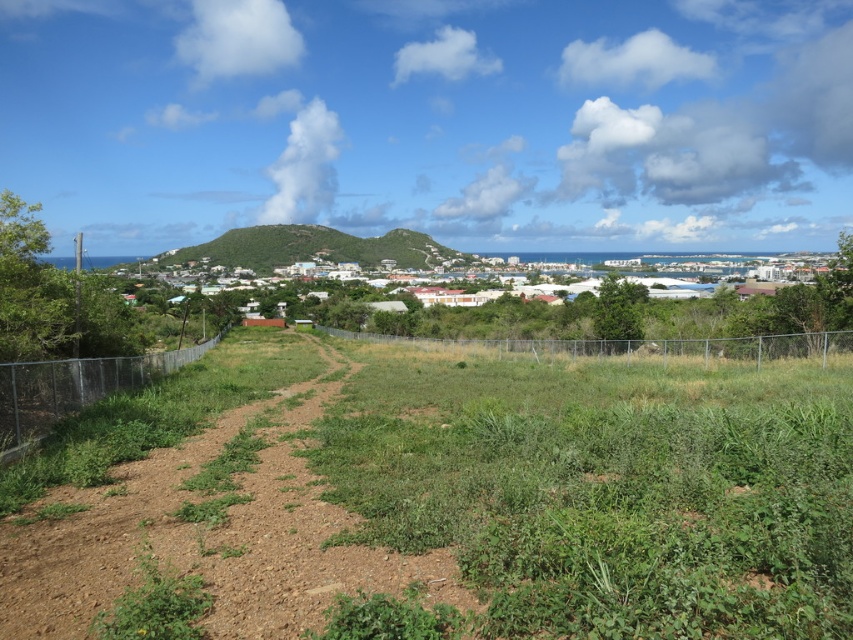
Does metallic chain-link fence at left appear on the right side of metallic chain-link fence at center?

In fact, metallic chain-link fence at left is to the left of metallic chain-link fence at center.

Can you confirm if metallic chain-link fence at left is positioned below metallic chain-link fence at center?

Yes.

Which is in front, point (109, 376) or point (741, 355)?

Point (109, 376)

Find the location of a particular element. Image resolution: width=853 pixels, height=640 pixels. metallic chain-link fence at left is located at coordinates (73, 388).

Does green matte buildings at center have a lesser width compared to green grassy hill at center?

Incorrect, green matte buildings at center's width is not less than green grassy hill at center's.

Who is taller, green matte buildings at center or green grassy hill at center?

green matte buildings at center

Measure the distance between green matte buildings at center and camera.

green matte buildings at center and camera are 31.10 meters apart.

You are a GUI agent. You are given a task and a screenshot of the screen. Output one action in this format:
    pyautogui.click(x=<x>, y=<y>)
    Task: Click on the green matte buildings at center
    This screenshot has height=640, width=853.
    Given the screenshot: What is the action you would take?
    pyautogui.click(x=749, y=305)

Is point (10, 397) positioned before point (245, 246)?

Yes, it is in front of point (245, 246).

Is metallic chain-link fence at left smaller than green grassy hill at center?

Indeed, metallic chain-link fence at left has a smaller size compared to green grassy hill at center.

Which is in front, point (24, 381) or point (260, 244)?

Point (24, 381) is in front.

The width and height of the screenshot is (853, 640). I want to click on metallic chain-link fence at left, so click(73, 388).